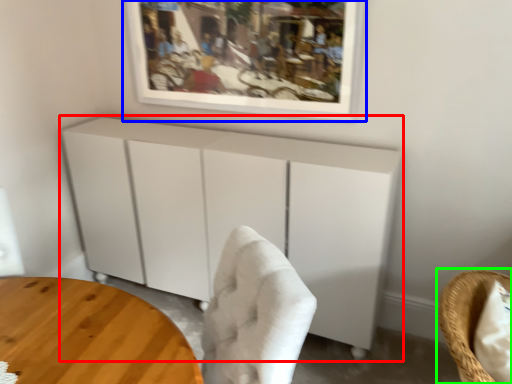
Question: Which object is positioned farthest from cabinetry (highlighted by a red box)? Select from picture frame (highlighted by a blue box) and chair (highlighted by a green box).

Choices:
 (A) picture frame
 (B) chair

Answer: (B)